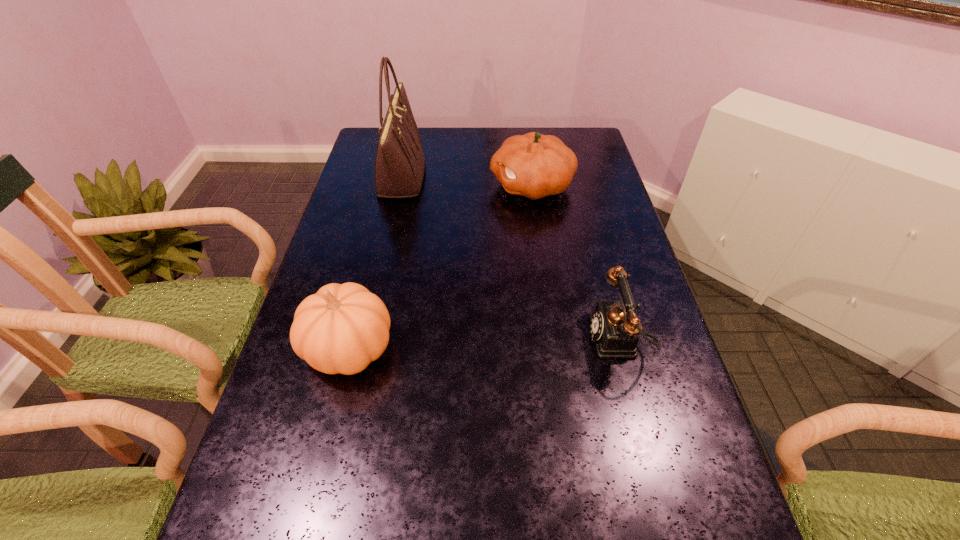
In the image, there is a desktop. Identify the location of vacant space at the far right corner. (588, 143).

Find the location of a particular element. This screenshot has width=960, height=540. free space between the telephone and the farther pumpkin is located at coordinates (575, 262).

You are a GUI agent. You are given a task and a screenshot of the screen. Output one action in this format:
    pyautogui.click(x=<x>, y=<y>)
    Task: Click on the unoccupied area between the tallest object and the telephone
    This screenshot has height=540, width=960.
    Given the screenshot: What is the action you would take?
    pyautogui.click(x=509, y=258)

Image resolution: width=960 pixels, height=540 pixels. I want to click on free spot between the right pumpkin and the handbag, so click(467, 181).

I want to click on vacant point located between the shortest object and the right pumpkin, so click(x=575, y=262).

Where is `vacant space in between the farther pumpkin and the nearer pumpkin`? The image size is (960, 540). vacant space in between the farther pumpkin and the nearer pumpkin is located at coordinates (441, 267).

This screenshot has height=540, width=960. Find the location of `object that is the second closest to the tallest object`. object that is the second closest to the tallest object is located at coordinates (342, 328).

Select which object is the closest to the handbag. Please provide its 2D coordinates. Your answer should be formatted as a tuple, i.e. [(x, y)], where the tuple contains the x and y coordinates of a point satisfying the conditions above.

[(533, 165)]

Where is `vacant space that satisfies the following two spatial constraints: 1. on the front face of the right pumpkin; 2. on the front side of the left pumpkin`? The height and width of the screenshot is (540, 960). vacant space that satisfies the following two spatial constraints: 1. on the front face of the right pumpkin; 2. on the front side of the left pumpkin is located at coordinates (555, 348).